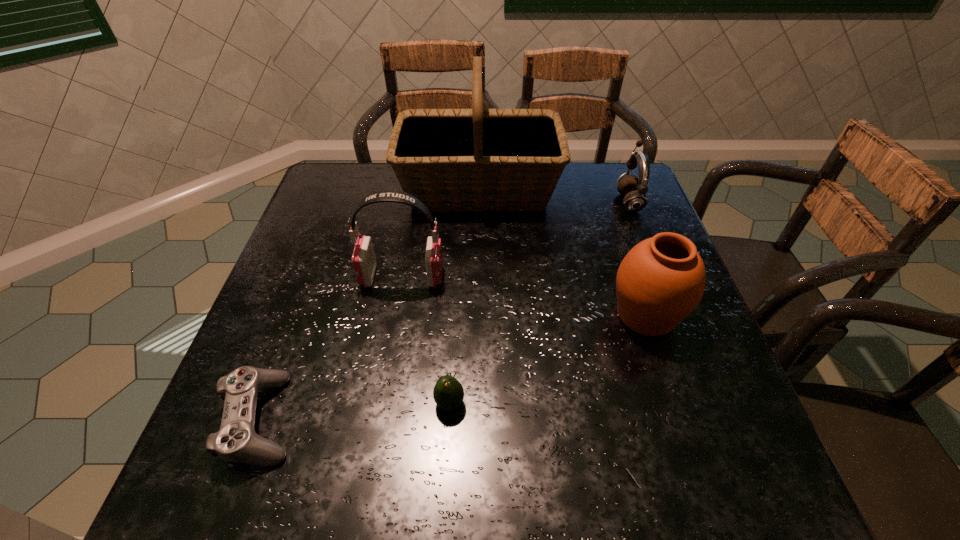
Image resolution: width=960 pixels, height=540 pixels. Identify the location of object present at the left edge. (237, 441).

Find the location of a particular element. urn present at the right edge is located at coordinates (661, 280).

This screenshot has width=960, height=540. What are the coordinates of `earphone situated at the right edge` in the screenshot? It's located at (634, 189).

I want to click on object that is at the near left corner, so click(237, 441).

This screenshot has width=960, height=540. I want to click on object present at the far right corner, so click(x=634, y=189).

In the image, there is a desktop. Identify the location of vacant space at the left edge. Image resolution: width=960 pixels, height=540 pixels. (308, 224).

Where is `vacant space at the right edge`? This screenshot has height=540, width=960. vacant space at the right edge is located at coordinates (614, 282).

What are the coordinates of `free region at the far left corner of the desktop` in the screenshot? It's located at (341, 208).

Identify the location of vacant region at the near right corner of the desktop. The image size is (960, 540). (664, 453).

You are a GUI agent. You are given a task and a screenshot of the screen. Output one action in this format:
    pyautogui.click(x=<x>, y=<y>)
    Task: Click on the empty space that is in between the tallest object and the taller earphone
    The width and height of the screenshot is (960, 540).
    Given the screenshot: What is the action you would take?
    pyautogui.click(x=441, y=233)